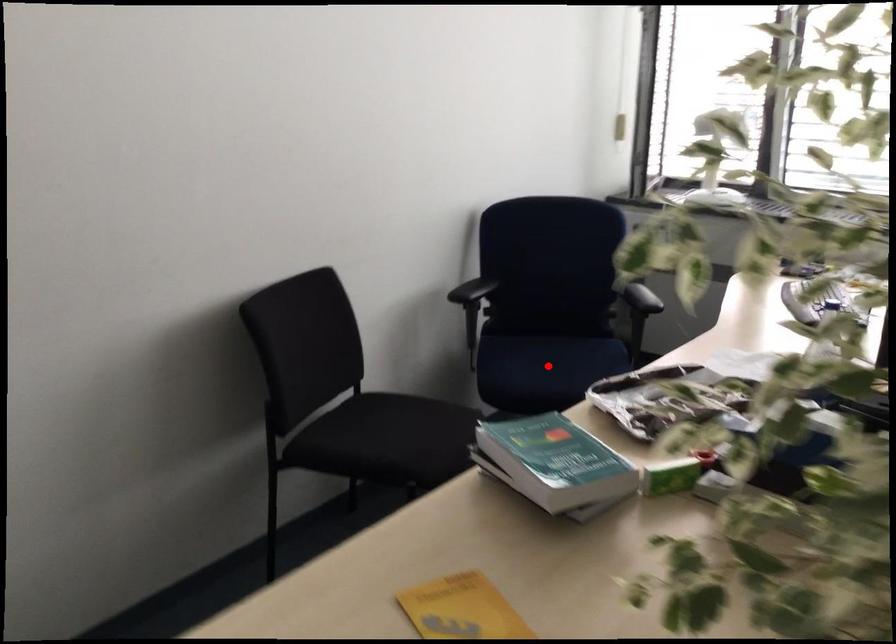
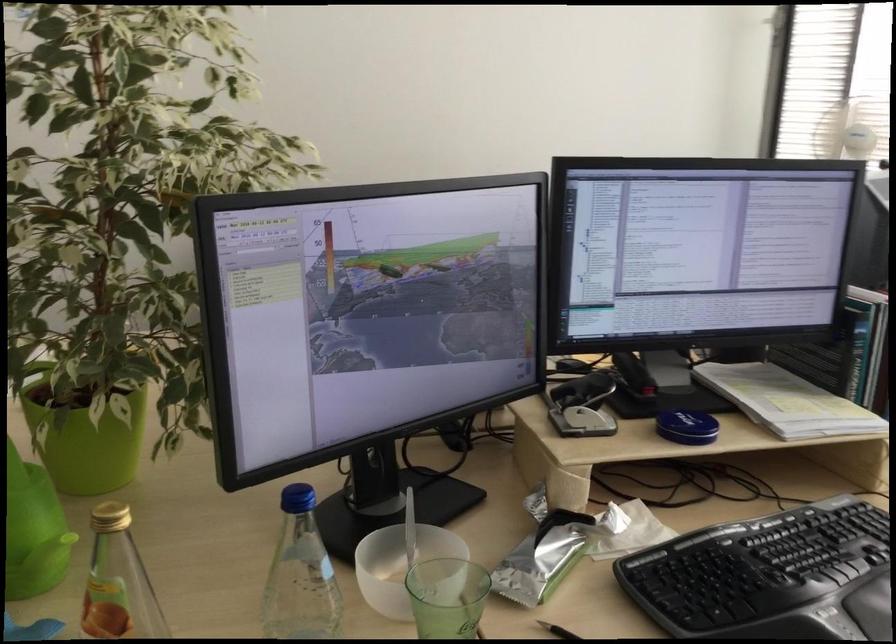
Question: I am providing you with two images of the same scene from different viewpoints. A red point is marked on the first image. At the location where the point appears in image 1, is it still visible in image 2?

Choices:
 (A) Yes
 (B) No

Answer: (B)